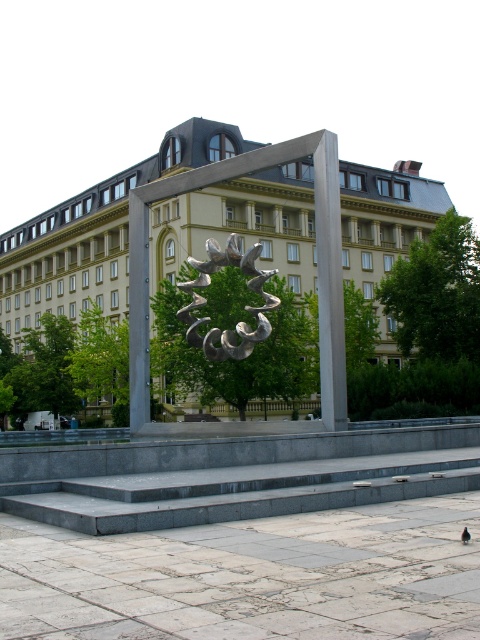
You are standing at the entrance of the plaza and want to take a photo of the satin silver sculpture at center. The entrance is at point A, which is located at coordinates 0.200, 0.750. Can you determine the direction you need to face to capture the sculpture in your camera view?

The satin silver sculpture at center is located at point (244, 307). Since you are at point (360, 128), you need to face towards the southeast direction to capture the sculpture in your camera view.

You are standing in the plaza and see the satin silver sculpture at center and the brown feathered pigeon at center. Which object is positioned to the left from your perspective?

The satin silver sculpture at center is to the left of the brown feathered pigeon at center from your perspective.